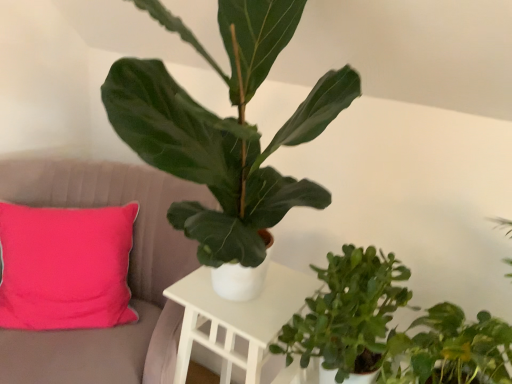
Question: Should I look upward or downward to see pink fabric cushion at left?

Choices:
 (A) down
 (B) up

Answer: (A)

Question: From the image's perspective, is pink fabric cushion at left below white matte table at center?

Choices:
 (A) yes
 (B) no

Answer: (B)

Question: Can you confirm if pink fabric cushion at left is bigger than white matte table at center?

Choices:
 (A) no
 (B) yes

Answer: (B)

Question: Is pink fabric cushion at left facing away from white matte table at center?

Choices:
 (A) no
 (B) yes

Answer: (A)

Question: Would you say pink fabric cushion at left is a long distance from white matte table at center?

Choices:
 (A) no
 (B) yes

Answer: (A)

Question: Does pink fabric cushion at left have a greater width compared to white matte table at center?

Choices:
 (A) no
 (B) yes

Answer: (B)

Question: Is white matte table at center inside pink fabric cushion at left?

Choices:
 (A) yes
 (B) no

Answer: (B)

Question: Can you confirm if green matte plant at center, positioned as the third houseplant in bottom-to-top order, is shorter than white matte table at center?

Choices:
 (A) no
 (B) yes

Answer: (A)

Question: Is green matte plant at center, the 1th houseplant from the top, with white matte table at center?

Choices:
 (A) yes
 (B) no

Answer: (B)

Question: Considering the relative sizes of green matte plant at center, positioned as the third houseplant in bottom-to-top order, and white matte table at center in the image provided, is green matte plant at center, positioned as the third houseplant in bottom-to-top order, thinner than white matte table at center?

Choices:
 (A) yes
 (B) no

Answer: (B)

Question: From the image's perspective, would you say green matte plant at center, the 1th houseplant from the top, is shown under white matte table at center?

Choices:
 (A) no
 (B) yes

Answer: (A)

Question: Is green matte plant at center, positioned as the third houseplant in bottom-to-top order, taller than white matte table at center?

Choices:
 (A) yes
 (B) no

Answer: (A)

Question: Can you confirm if green matte plant at center, positioned as the third houseplant in bottom-to-top order, is wider than white matte table at center?

Choices:
 (A) no
 (B) yes

Answer: (B)

Question: Does green matte plant at center, positioned as the third houseplant in bottom-to-top order, appear on the left side of green matte plant at lower right, which is counted as the 3th houseplant, starting from the top?

Choices:
 (A) no
 (B) yes

Answer: (B)